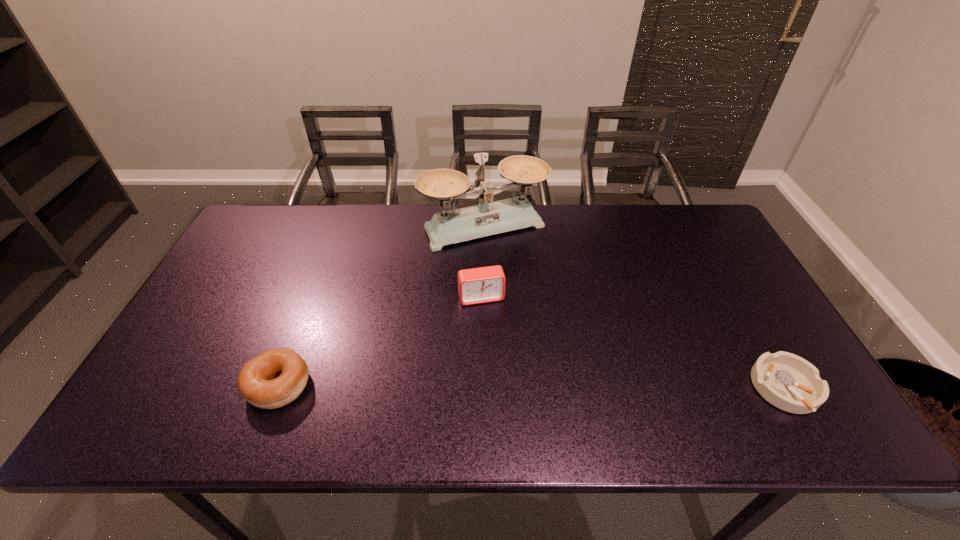
Locate an element on the screen. The width and height of the screenshot is (960, 540). vacant space that satisfies the following two spatial constraints: 1. on the back side of the third tallest object; 2. on the left side of the farthest object is located at coordinates (338, 227).

Identify the location of free space in the image that satisfies the following two spatial constraints: 1. on the front side of the shortest object; 2. on the left side of the second farthest object. The width and height of the screenshot is (960, 540). (482, 388).

Locate an element on the screen. The image size is (960, 540). vacant area that satisfies the following two spatial constraints: 1. on the front side of the rightmost object; 2. on the right side of the third nearest object is located at coordinates (482, 388).

Find the location of `blank space that satisfies the following two spatial constraints: 1. on the back side of the third tallest object; 2. on the left side of the tallest object`. blank space that satisfies the following two spatial constraints: 1. on the back side of the third tallest object; 2. on the left side of the tallest object is located at coordinates click(x=338, y=227).